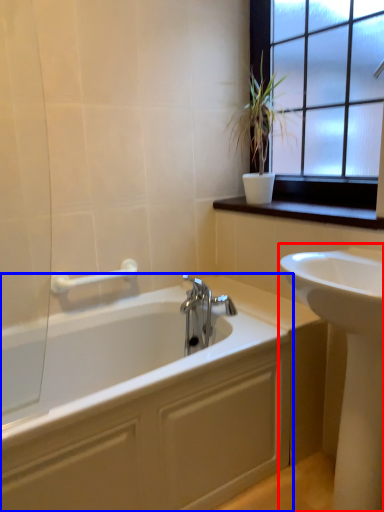
Question: Which object is closer to the camera taking this photo, sink (highlighted by a red box) or bathtub (highlighted by a blue box)?

Choices:
 (A) sink
 (B) bathtub

Answer: (A)